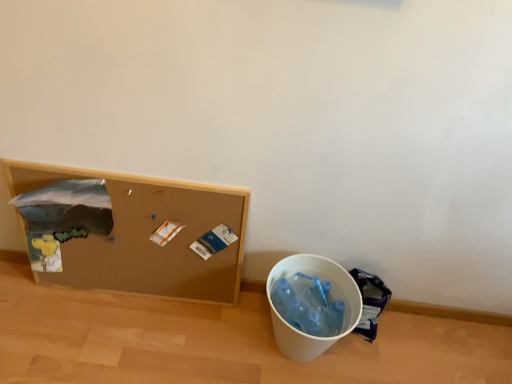
Question: Would you say white plastic bucket at lower right is outside blue plastic bag at lower right?

Choices:
 (A) yes
 (B) no

Answer: (A)

Question: Considering the relative sizes of white plastic bucket at lower right and blue plastic bag at lower right in the image provided, is white plastic bucket at lower right thinner than blue plastic bag at lower right?

Choices:
 (A) yes
 (B) no

Answer: (B)

Question: Does white plastic bucket at lower right have a lesser height compared to blue plastic bag at lower right?

Choices:
 (A) yes
 (B) no

Answer: (B)

Question: Does white plastic bucket at lower right touch blue plastic bag at lower right?

Choices:
 (A) yes
 (B) no

Answer: (B)

Question: Considering the relative sizes of white plastic bucket at lower right and blue plastic bag at lower right in the image provided, is white plastic bucket at lower right wider than blue plastic bag at lower right?

Choices:
 (A) no
 (B) yes

Answer: (B)

Question: From the image's perspective, relative to brown corkboard at left, is blue plastic bag at lower right above or below?

Choices:
 (A) above
 (B) below

Answer: (B)

Question: Would you say blue plastic bag at lower right is inside or outside brown corkboard at left?

Choices:
 (A) inside
 (B) outside

Answer: (B)

Question: Looking at the image, does blue plastic bag at lower right seem bigger or smaller compared to brown corkboard at left?

Choices:
 (A) big
 (B) small

Answer: (B)

Question: In terms of height, does blue plastic bag at lower right look taller or shorter compared to brown corkboard at left?

Choices:
 (A) tall
 (B) short

Answer: (B)

Question: Considering the positions of brown corkboard at left and white plastic bucket at lower right in the image, is brown corkboard at left bigger or smaller than white plastic bucket at lower right?

Choices:
 (A) big
 (B) small

Answer: (A)

Question: Looking at their shapes, would you say brown corkboard at left is wider or thinner than white plastic bucket at lower right?

Choices:
 (A) wide
 (B) thin

Answer: (B)

Question: From the image's perspective, relative to white plastic bucket at lower right, is brown corkboard at left above or below?

Choices:
 (A) above
 (B) below

Answer: (A)

Question: Considering the positions of brown corkboard at left and white plastic bucket at lower right in the image, is brown corkboard at left taller or shorter than white plastic bucket at lower right?

Choices:
 (A) tall
 (B) short

Answer: (A)

Question: In terms of width, does white plastic bucket at lower right look wider or thinner when compared to blue plastic bag at lower right?

Choices:
 (A) thin
 (B) wide

Answer: (B)

Question: In the image, is white plastic bucket at lower right positioned in front of or behind blue plastic bag at lower right?

Choices:
 (A) front
 (B) behind

Answer: (A)